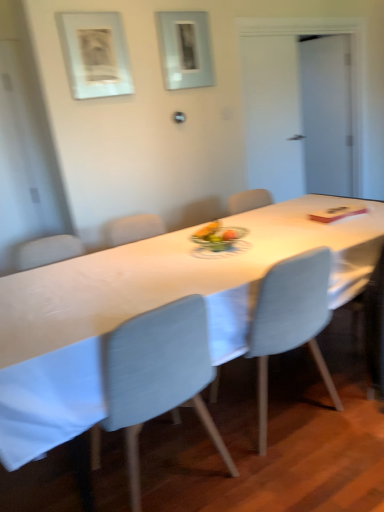
Identify the location of vacant area on top of transparent glass door at upper right (from a real-world perspective). (322, 38).